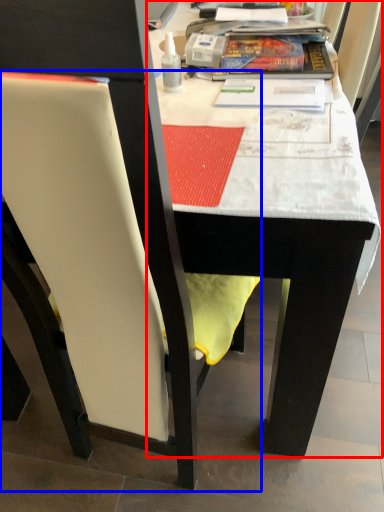
Question: Which point is further to the camera, table (highlighted by a red box) or chair (highlighted by a blue box)?

Choices:
 (A) table
 (B) chair

Answer: (A)